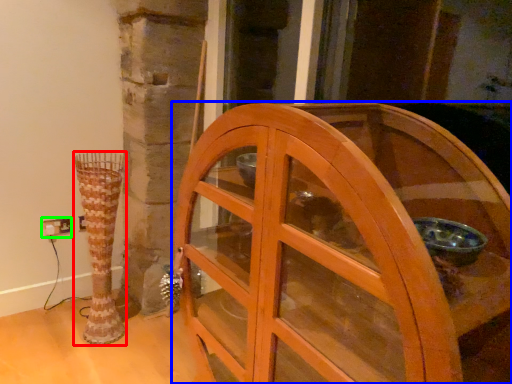
Question: Based on their relative distances, which object is farther from vase (highlighted by a red box)? Choose from furniture (highlighted by a blue box) and electric outlet (highlighted by a green box).

Choices:
 (A) furniture
 (B) electric outlet

Answer: (A)